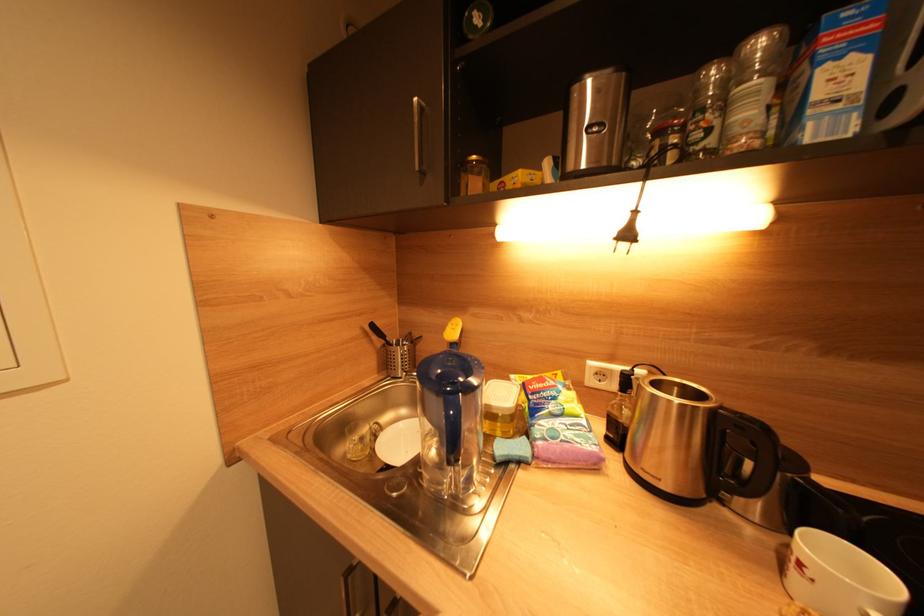
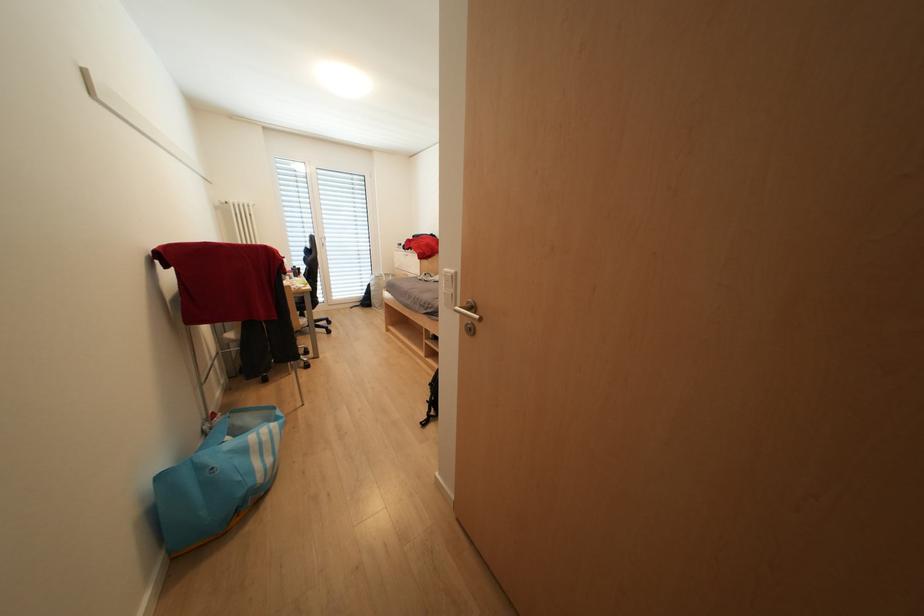
Question: Which direction would the cameraman need to move to produce the second image? Reply with the corresponding letter.

Choices:
 (A) Left
 (B) Right
 (C) Forward
 (D) Backward

Answer: (A)